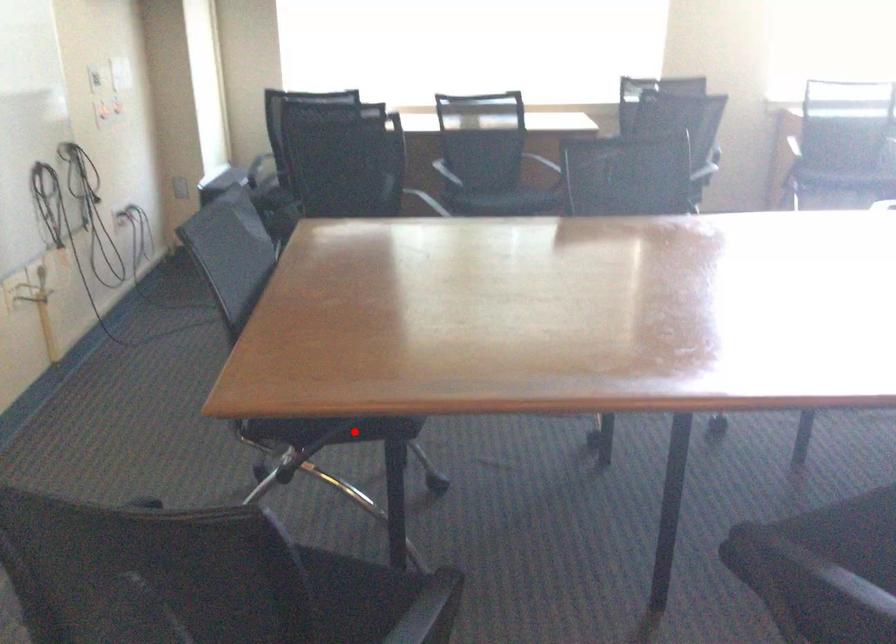
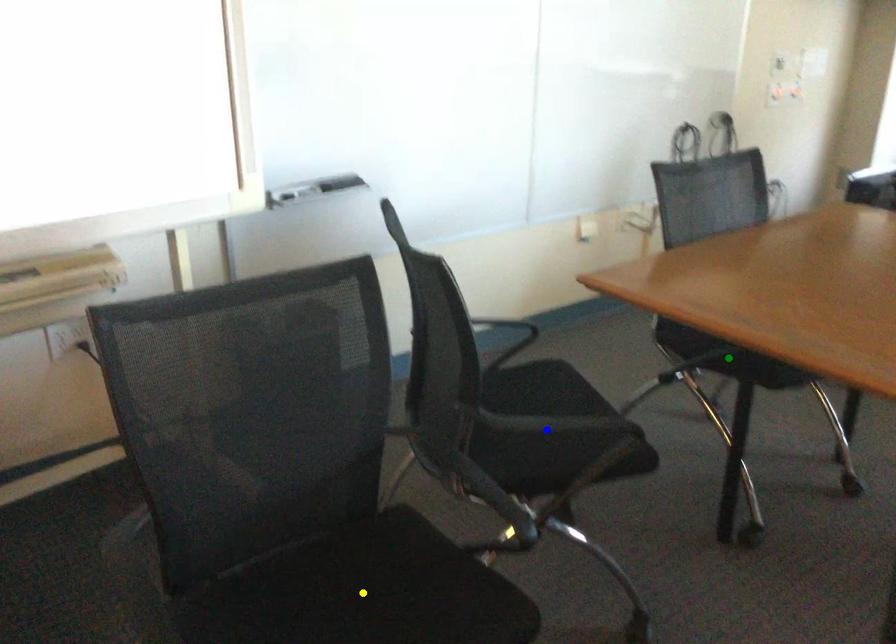
Question: I am providing you with two images of the same scene from different viewpoints. A red point is marked on the first image. You are given multiple points on the second image. Which point in image 2 represents the same 3d spot as the red point in image 1?

Choices:
 (A) green point
 (B) yellow point
 (C) blue point

Answer: (A)